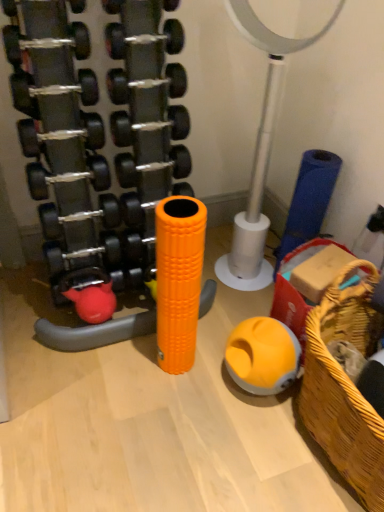
You are a GUI agent. You are given a task and a screenshot of the screen. Output one action in this format:
    pyautogui.click(x=<x>, y=<y>)
    Task: Click on the vacant space to the left of woven wood basket at lower right
    The image size is (384, 512).
    Given the screenshot: What is the action you would take?
    pyautogui.click(x=228, y=435)